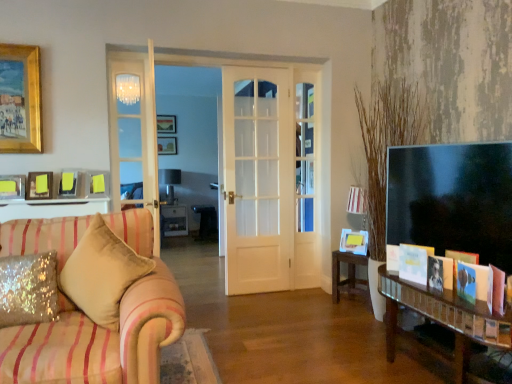
Question: Considering the positions of matte pink book at lower right, marked as the first book in a front-to-back arrangement, and wooden picture frame at center, placed as the 4th picture frame when sorted from right to left, in the image, is matte pink book at lower right, marked as the first book in a front-to-back arrangement, taller or shorter than wooden picture frame at center, placed as the 4th picture frame when sorted from right to left,?

Choices:
 (A) short
 (B) tall

Answer: (A)

Question: Does point (502, 304) appear closer or farther from the camera than point (164, 150)?

Choices:
 (A) farther
 (B) closer

Answer: (B)

Question: Which is farther from the velvet beige pillow at left, the 1th pillow viewed from the right?

Choices:
 (A) white glossy cabinet at center, which is counted as the 1th table, starting from the back
 (B) yellow paper at upper left, the 2th picture frame in the front-to-back sequence
 (C) wooden picture frame at center, arranged as the sixth picture frame when viewed from the front
 (D) white paper card at lower right, which ranks as the 2th book in back-to-front order
 (E) wooden table at center, the 1th table when ordered from right to left

Answer: (C)

Question: Which of these objects is positioned closest to the matte pink book at lower right, marked as the first book in a front-to-back arrangement?

Choices:
 (A) glittery sequined pillow at lower left, the second pillow in the right-to-left sequence
 (B) white glossy cabinet at center, which is the first table from left to right
 (C) yellow paper at upper left, which appears as the 4th picture frame when viewed from the left
 (D) matte gold picture frame at upper left, acting as the 6th picture frame starting from the back
 (E) white paper at right, marked as the 1th book in a back-to-front arrangement

Answer: (E)